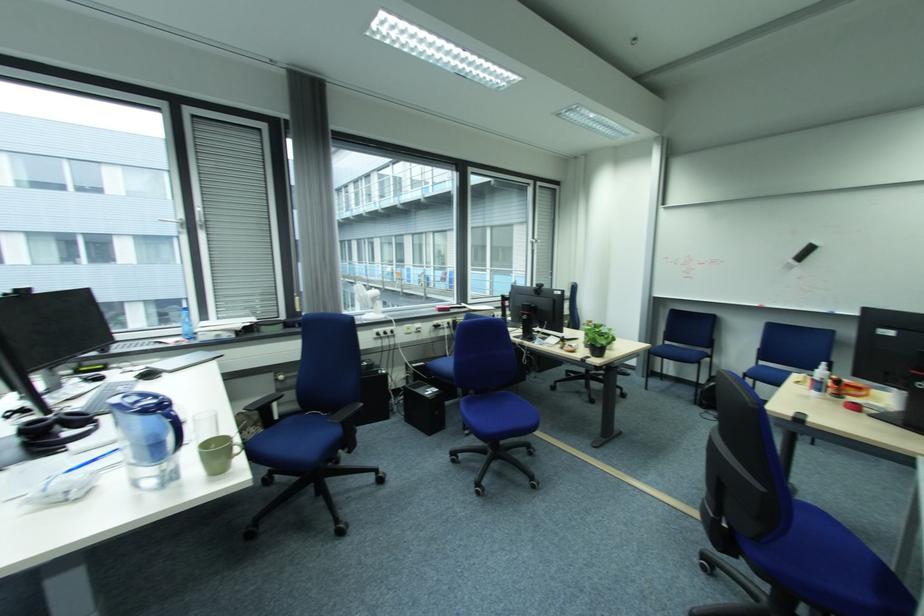
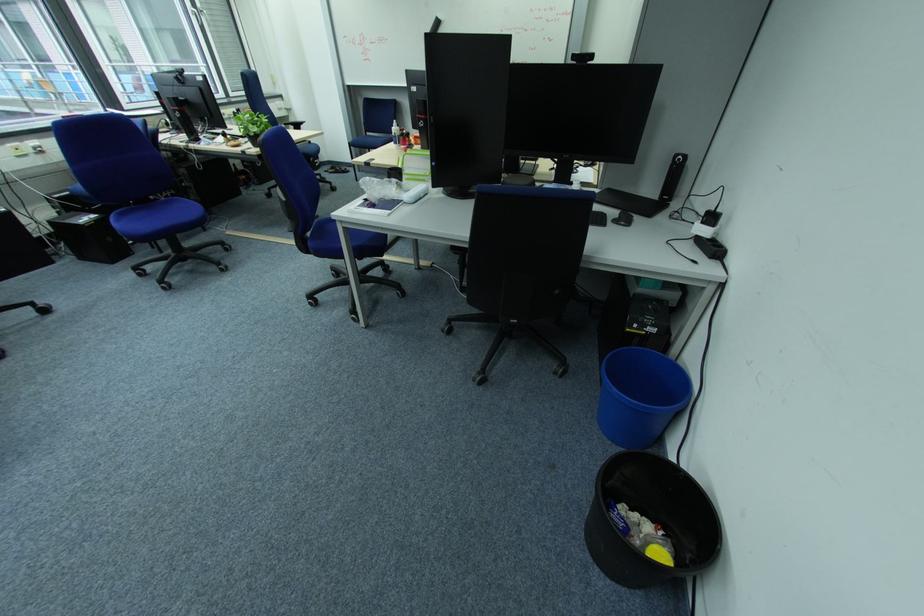
Find the pixel in the second image that matches the point at 675,344 in the first image.

(378, 135)